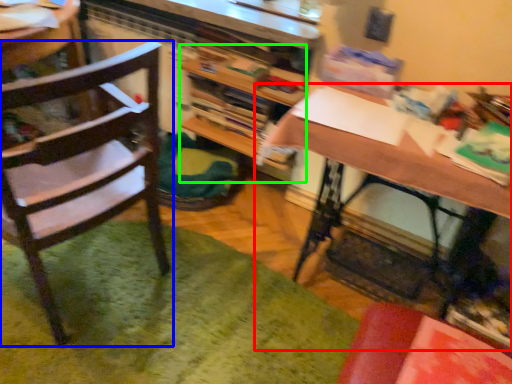
Question: Considering the real-world distances, which object is farthest from desk (highlighted by a red box)? chair (highlighted by a blue box) or bookshelf (highlighted by a green box)?

Choices:
 (A) chair
 (B) bookshelf

Answer: (A)